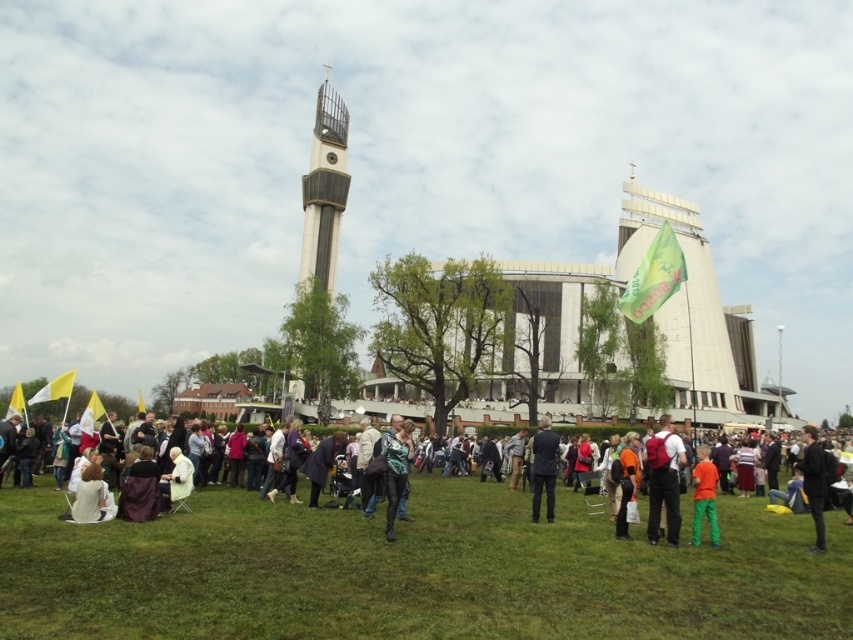
Question: Does smooth concrete bell tower at center have a lesser width compared to matte red backpack at center?

Choices:
 (A) no
 (B) yes

Answer: (B)

Question: Does green leather jacket at center have a greater width compared to dark blue leather jacket at lower right?

Choices:
 (A) no
 (B) yes

Answer: (A)

Question: Which object appears closest to the camera in this image?

Choices:
 (A) green leather jacket at center
 (B) matte black jacket at center

Answer: (B)

Question: Which object appears farthest from the camera in this image?

Choices:
 (A) dark blue suit at center
 (B) green grass at center
 (C) matte black jacket at center

Answer: (A)

Question: Does matte black jacket at center lie behind dark blue suit at center?

Choices:
 (A) no
 (B) yes

Answer: (A)

Question: Which point is closer to the camera?

Choices:
 (A) (628, 545)
 (B) (548, 483)

Answer: (A)